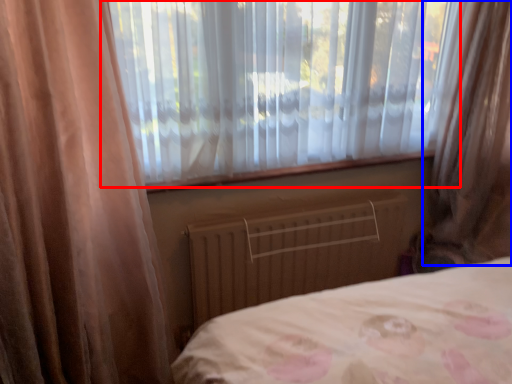
Question: Which object is closer to the camera taking this photo, window (highlighted by a red box) or curtain (highlighted by a blue box)?

Choices:
 (A) window
 (B) curtain

Answer: (B)